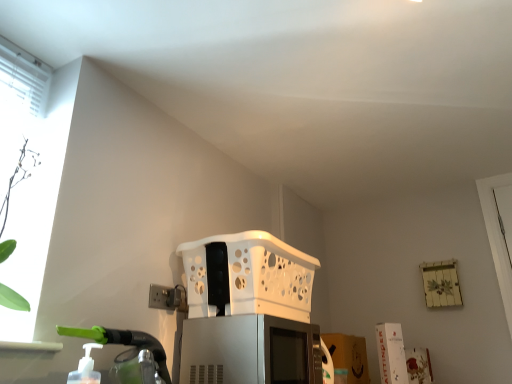
Find the location of a particular element. Image resolution: width=512 pixels, height=384 pixels. white plastic basket at center is located at coordinates (248, 276).

Where is `white plastic electric outlet at lower left`? This screenshot has height=384, width=512. white plastic electric outlet at lower left is located at coordinates tap(165, 297).

Where is `satin silver microwave at center`? satin silver microwave at center is located at coordinates (250, 351).

Find the location of `white plastic basket at center`. white plastic basket at center is located at coordinates (248, 276).

From the image's perspective, is satin silver microwave at center located beneath white plastic basket at center?

Yes.

Measure the distance from satin silver microwave at center to white plastic basket at center.

They are 8.25 inches apart.

Does satin silver microwave at center lie behind white plastic basket at center?

No, satin silver microwave at center is closer to the viewer.

Locate an element on the screen. The width and height of the screenshot is (512, 384). basket lying above the satin silver microwave at center (from the image's perspective) is located at coordinates (248, 276).

Would you say white plastic electric outlet at lower left is outside white plastic basket at center?

Absolutely, white plastic electric outlet at lower left is external to white plastic basket at center.

In order to click on electric outlet behind the white plastic basket at center in this screenshot , I will do `click(165, 297)`.

From the image's perspective, is white plastic electric outlet at lower left above or below white plastic basket at center?

From the image's perspective, white plastic electric outlet at lower left appears above white plastic basket at center.

Is white plastic electric outlet at lower left wider or thinner than white plastic basket at center?

In the image, white plastic electric outlet at lower left appears to be more narrow than white plastic basket at center.

Is white plastic electric outlet at lower left aimed at satin silver microwave at center?

No, white plastic electric outlet at lower left does not turn towards satin silver microwave at center.

Considering the relative sizes of white plastic electric outlet at lower left and satin silver microwave at center in the image provided, is white plastic electric outlet at lower left smaller than satin silver microwave at center?

Yes.

Is white plastic electric outlet at lower left taller or shorter than satin silver microwave at center?

In the image, white plastic electric outlet at lower left appears to be shorter than satin silver microwave at center.

Is satin silver microwave at center located outside white plastic electric outlet at lower left?

Yes.

Considering the sizes of objects satin silver microwave at center and white plastic electric outlet at lower left in the image provided, who is thinner, satin silver microwave at center or white plastic electric outlet at lower left?

white plastic electric outlet at lower left.

From the picture: Is satin silver microwave at center smaller than white plastic electric outlet at lower left?

No.

Considering the positions of points (304, 337) and (164, 305), is point (304, 337) farther from camera compared to point (164, 305)?

Yes, it is behind point (164, 305).

Would you say white plastic electric outlet at lower left is part of white plastic basket at center's contents?

Definitely not — white plastic electric outlet at lower left is not inside white plastic basket at center.

Who is bigger, white plastic basket at center or white plastic electric outlet at lower left?

white plastic basket at center is bigger.

Does white plastic basket at center come in front of white plastic electric outlet at lower left?

Yes, the depth of white plastic basket at center is less than that of white plastic electric outlet at lower left.

Based on the photo, would you say white plastic basket at center is a long distance from white plastic electric outlet at lower left?

No, white plastic basket at center is not far away from white plastic electric outlet at lower left.

Can you tell me how much white plastic basket at center and satin silver microwave at center differ in facing direction?

They differ by 1.7 degrees in their facing directions.

From a real-world perspective, is white plastic basket at center physically located above or below satin silver microwave at center?

white plastic basket at center is situated higher than satin silver microwave at center in the real world.

Image resolution: width=512 pixels, height=384 pixels. Identify the location of basket on the left of satin silver microwave at center. (248, 276).

Considering the relative sizes of white plastic basket at center and satin silver microwave at center in the image provided, is white plastic basket at center wider than satin silver microwave at center?

Yes.

The height and width of the screenshot is (384, 512). Find the location of `appliance located in front of the white plastic basket at center`. appliance located in front of the white plastic basket at center is located at coordinates (250, 351).

Image resolution: width=512 pixels, height=384 pixels. I want to click on electric outlet lying behind the white plastic basket at center, so click(165, 297).

Looking at the image, which one is located closer to white plastic electric outlet at lower left, satin silver microwave at center or white plastic basket at center?

satin silver microwave at center.

From the picture: Based on their spatial positions, is white plastic basket at center or white plastic electric outlet at lower left further from satin silver microwave at center?

white plastic basket at center is positioned further to the anchor satin silver microwave at center.

Estimate the real-world distances between objects in this image. Which object is closer to white plastic electric outlet at lower left, white plastic basket at center or satin silver microwave at center?

Based on the image, satin silver microwave at center appears to be nearer to white plastic electric outlet at lower left.

Looking at the image, which one is located closer to white plastic basket at center, white plastic electric outlet at lower left or satin silver microwave at center?

The object closer to white plastic basket at center is satin silver microwave at center.

Considering their positions, is white plastic electric outlet at lower left positioned further to satin silver microwave at center than white plastic basket at center?

white plastic basket at center is further to satin silver microwave at center.

Which object lies further to the anchor point white plastic basket at center, satin silver microwave at center or white plastic electric outlet at lower left?

white plastic electric outlet at lower left is positioned further to the anchor white plastic basket at center.

Find the location of `basket located between white plastic electric outlet at lower left and satin silver microwave at center in the left-right direction`. basket located between white plastic electric outlet at lower left and satin silver microwave at center in the left-right direction is located at coordinates (248, 276).